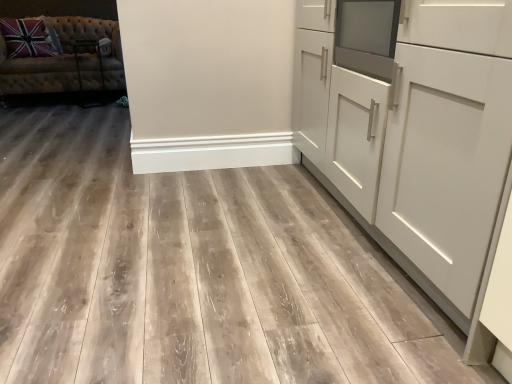
Question: Considering the positions of point (47, 61) and point (462, 168), is point (47, 61) closer or farther from the camera than point (462, 168)?

Choices:
 (A) closer
 (B) farther

Answer: (B)

Question: Considering their positions, is tufted fabric studio couch at upper left located in front of or behind white matte cabinet at right?

Choices:
 (A) front
 (B) behind

Answer: (B)

Question: From the image's perspective, is tufted fabric studio couch at upper left above or below white matte cabinet at right?

Choices:
 (A) below
 (B) above

Answer: (B)

Question: Does point (468, 238) appear closer or farther from the camera than point (88, 89)?

Choices:
 (A) closer
 (B) farther

Answer: (A)

Question: Based on their sizes in the image, would you say white matte cabinet at right is bigger or smaller than tufted fabric studio couch at upper left?

Choices:
 (A) big
 (B) small

Answer: (A)

Question: Is white matte cabinet at right spatially inside tufted fabric studio couch at upper left, or outside of it?

Choices:
 (A) outside
 (B) inside

Answer: (A)

Question: In terms of height, does white matte cabinet at right look taller or shorter compared to tufted fabric studio couch at upper left?

Choices:
 (A) short
 (B) tall

Answer: (B)